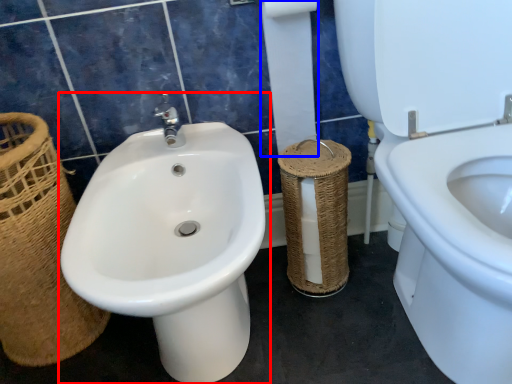
Question: Which object appears closest to the camera in this image, sink (highlighted by a red box) or toilet paper (highlighted by a blue box)?

Choices:
 (A) sink
 (B) toilet paper

Answer: (A)